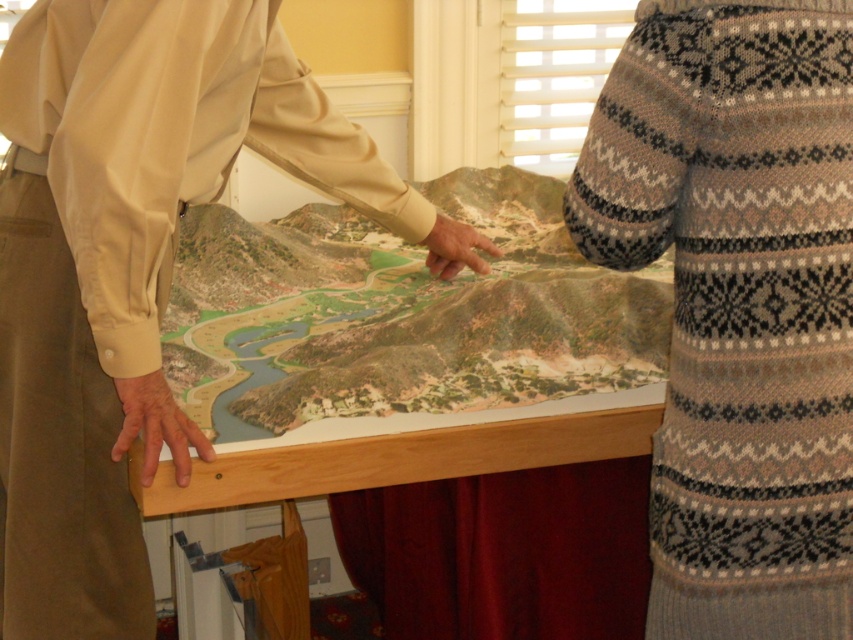
Question: Is the position of knitted sweater at upper right more distant than that of beige fabric shirt at upper left?

Choices:
 (A) no
 (B) yes

Answer: (A)

Question: Does knitted sweater at upper right have a greater width compared to beige fabric shirt at upper left?

Choices:
 (A) no
 (B) yes

Answer: (A)

Question: Which point is farther to the camera?

Choices:
 (A) (51, 483)
 (B) (756, 552)

Answer: (A)

Question: Is knitted sweater at upper right positioned at the back of beige fabric shirt at upper left?

Choices:
 (A) no
 (B) yes

Answer: (A)

Question: Which object is closer to the camera taking this photo?

Choices:
 (A) beige fabric shirt at upper left
 (B) knitted sweater at upper right

Answer: (B)